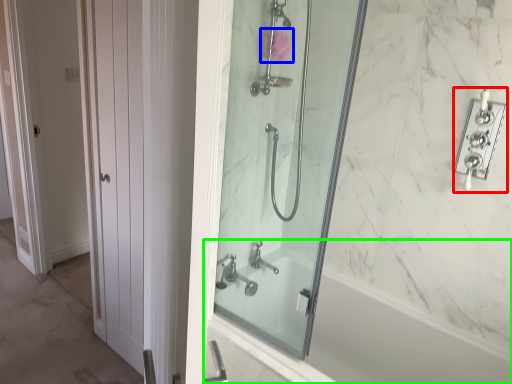
Question: Which is nearer to the lock (highlighted by a red box)? flower (highlighted by a blue box) or bathtub (highlighted by a green box).

Choices:
 (A) flower
 (B) bathtub

Answer: (A)